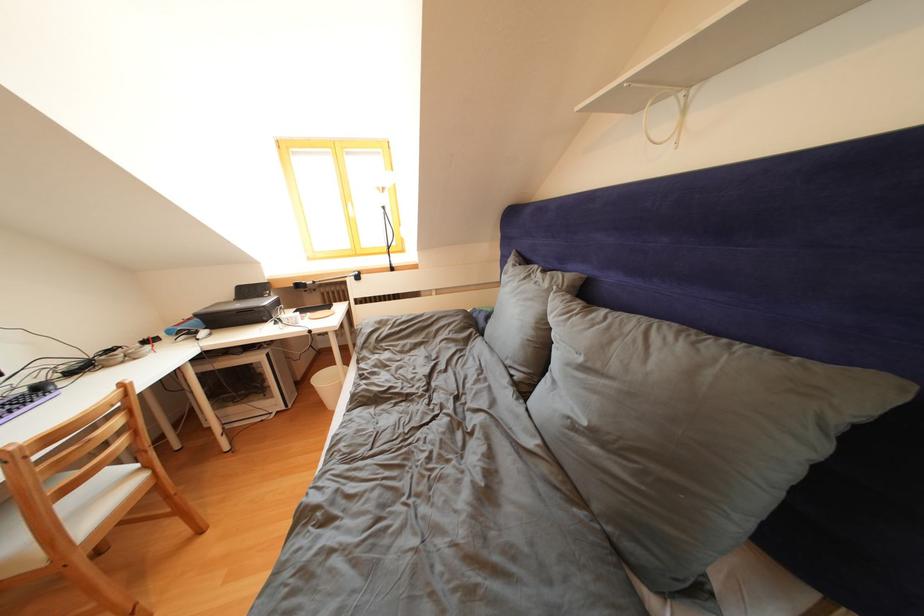
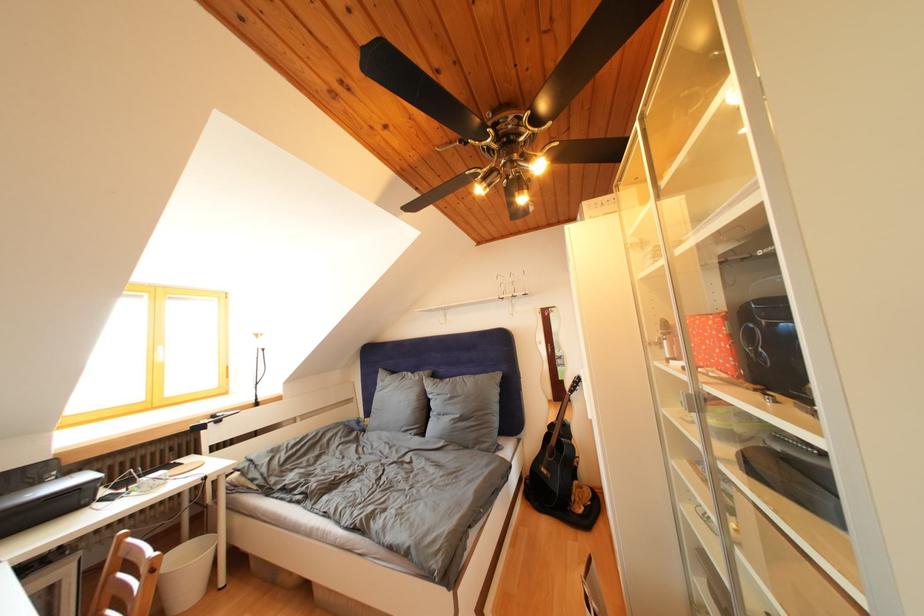
In the second image, find the point that corresponds to the point at 553,290 in the first image.

(426, 383)